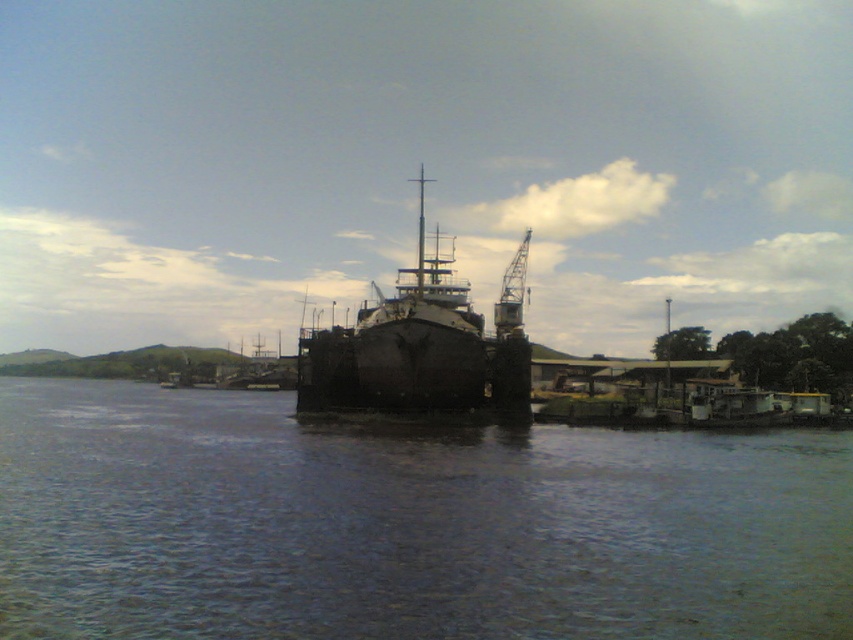
In the scene shown: Is the position of dark blue water at center more distant than that of rusty metal ship at center?

No, it is in front of rusty metal ship at center.

What do you see at coordinates (405, 524) in the screenshot? This screenshot has height=640, width=853. I see `dark blue water at center` at bounding box center [405, 524].

Where is `dark blue water at center`? Image resolution: width=853 pixels, height=640 pixels. dark blue water at center is located at coordinates (405, 524).